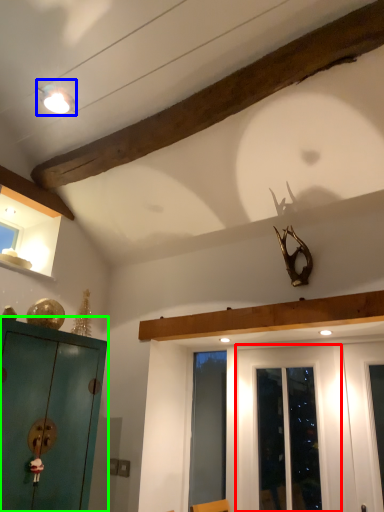
Question: Based on their relative distances, which object is nearer to door (highlighted by a red box)? Choose from light fixture (highlighted by a blue box) and cabinetry (highlighted by a green box).

Choices:
 (A) light fixture
 (B) cabinetry

Answer: (B)